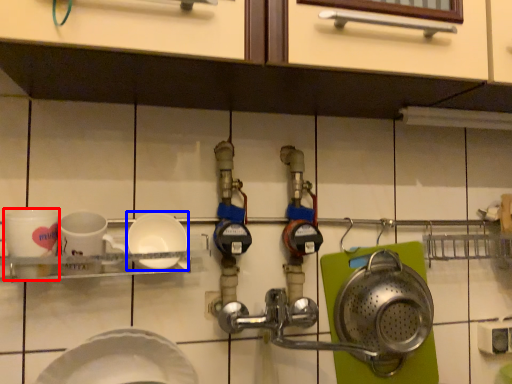
Question: Which object is closer to the camera taking this photo, coffee cup (highlighted by a red box) or plate (highlighted by a blue box)?

Choices:
 (A) coffee cup
 (B) plate

Answer: (A)